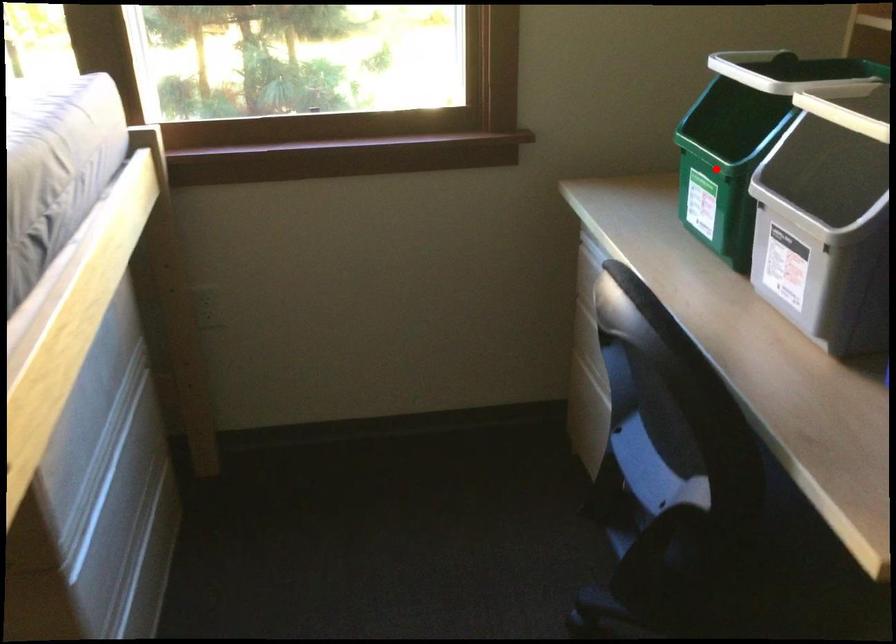
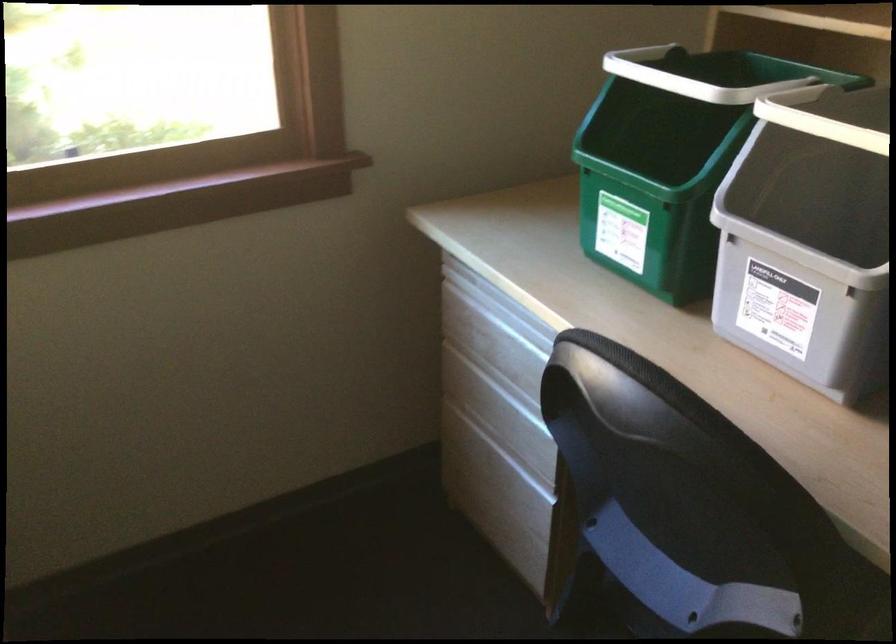
Question: I am providing you with two images of the same scene from different viewpoints. A red point is shown in image1. For the corresponding object point in image2, is it positioned nearer or farther from the camera?

Choices:
 (A) Nearer
 (B) Farther

Answer: (A)